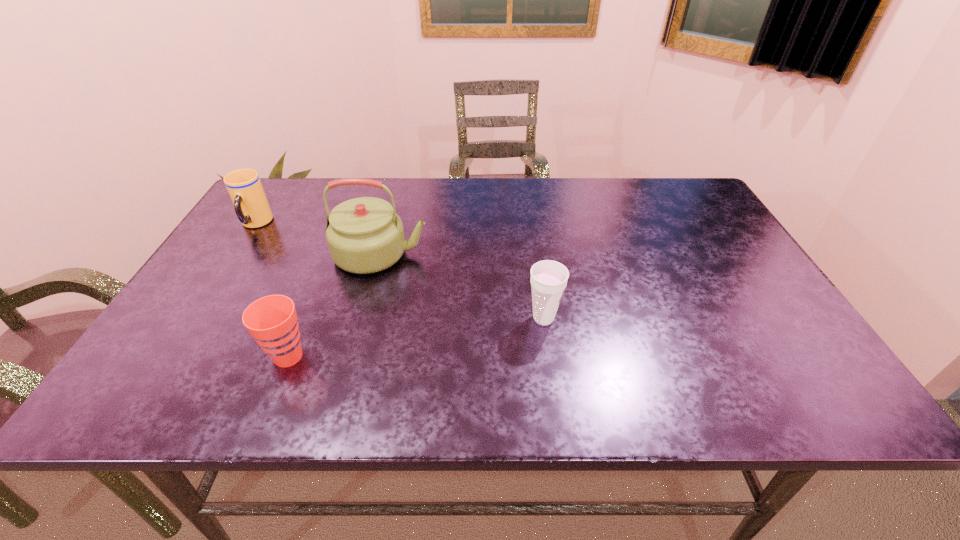
You are a GUI agent. You are given a task and a screenshot of the screen. Output one action in this format:
    pyautogui.click(x=<x>, y=<y>)
    Task: Click on the vacant point that satisfies the following two spatial constraints: 1. at the spout of the tallest object; 2. on the back side of the rightmost cup
    The height and width of the screenshot is (540, 960).
    Given the screenshot: What is the action you would take?
    pyautogui.click(x=364, y=318)

At what (x,y) coordinates should I click in order to perform the action: click on vacant area that satisfies the following two spatial constraints: 1. on the side of the leftmost cup with the handle; 2. on the left side of the nearest cup. Please return your answer as a coordinate pair (x, y). The height and width of the screenshot is (540, 960). Looking at the image, I should click on (169, 356).

Find the location of a particular element. The image size is (960, 540). free spot that satisfies the following two spatial constraints: 1. on the side of the second cup from left to right with the handle; 2. on the right side of the farthest cup is located at coordinates (169, 356).